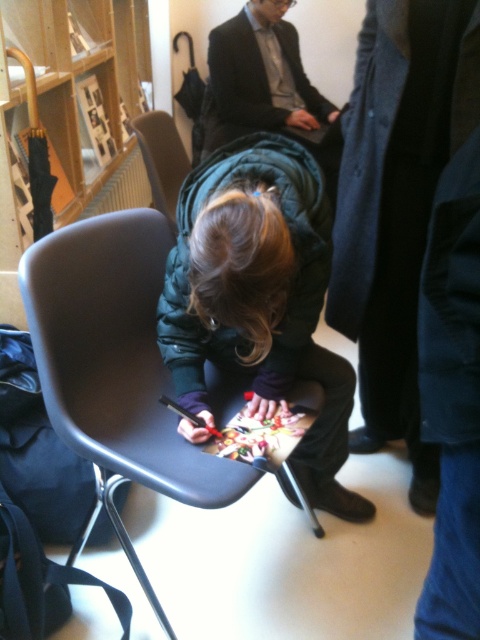
Is matte gray plastic chair at center behind dark gray suit at upper center?

No, it is in front of dark gray suit at upper center.

Is point (136, 266) more distant than point (235, 104)?

No, it is in front of (235, 104).

Which is in front, point (85, 356) or point (208, 113)?

Point (85, 356)

Locate an element on the screen. Image resolution: width=480 pixels, height=640 pixels. matte gray plastic chair at center is located at coordinates (116, 355).

Is point (208, 493) closer to camera compared to point (267, 337)?

Yes, it is in front of point (267, 337).

Which is in front, point (60, 403) or point (274, 273)?

Point (274, 273) is in front.

Find the location of a particular element. matte gray plastic chair at center is located at coordinates (116, 355).

Does dark gray suit at upper center have a greater width compared to matte gray chair at center?

Correct, the width of dark gray suit at upper center exceeds that of matte gray chair at center.

Is dark gray suit at upper center taller than matte gray chair at center?

Yes.

Locate an element on the screen. dark gray suit at upper center is located at coordinates (257, 77).

You are a GUI agent. You are given a task and a screenshot of the screen. Output one action in this format:
    pyautogui.click(x=<x>, y=<y>)
    Task: Click on the dark gray suit at upper center
    This screenshot has height=640, width=480.
    Given the screenshot: What is the action you would take?
    pyautogui.click(x=257, y=77)